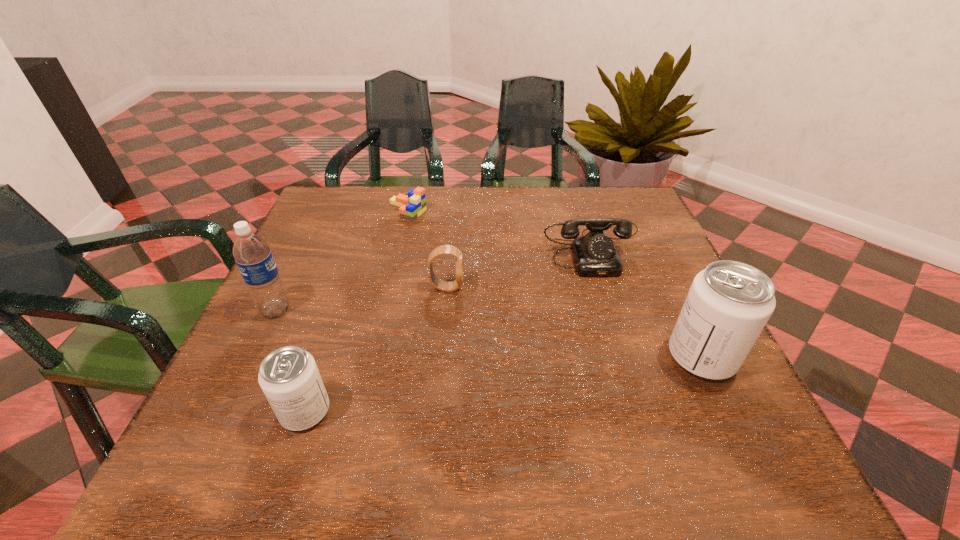
Find the location of `the nearest object`. the nearest object is located at coordinates (289, 377).

You are a GUI agent. You are given a task and a screenshot of the screen. Output one action in this format:
    pyautogui.click(x=<x>, y=<y>)
    Task: Click on the third tallest object
    The image size is (960, 540).
    Given the screenshot: What is the action you would take?
    pyautogui.click(x=289, y=377)

I want to click on the right soda can, so click(729, 303).

This screenshot has height=540, width=960. I want to click on the second nearest object, so click(729, 303).

The image size is (960, 540). I want to click on Lego, so click(412, 206).

This screenshot has width=960, height=540. I want to click on the third object from left to right, so click(x=412, y=206).

Identify the location of telephone. This screenshot has height=540, width=960. (595, 255).

The height and width of the screenshot is (540, 960). What are the coordinates of `watch` in the screenshot? It's located at (441, 285).

Locate an element on the screen. the third farthest object is located at coordinates (441, 285).

Where is `the leftmost object`? The image size is (960, 540). the leftmost object is located at coordinates (251, 252).